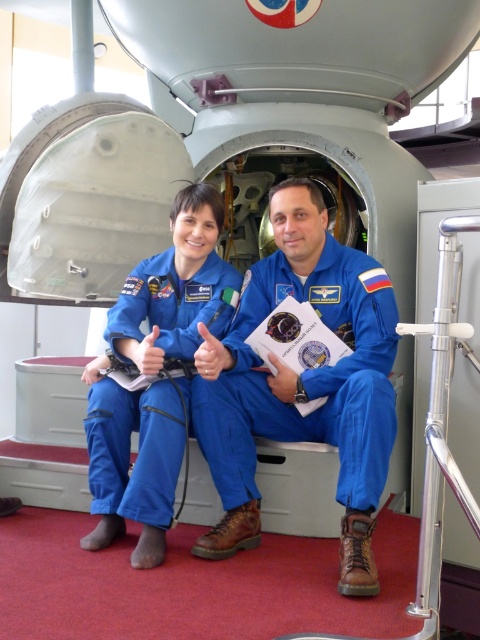
You are an astronaut inside the space capsule. You need to reach the control panel to adjust the settings. The control panel is located at point (301, 384). Can you tell me which object is at that point?

The blue fabric spacesuit at center is located at point (301, 384).

You are an engineer inspecting the space capsule. You notice two astronauts in blue suits. Which astronaut is sitting to the right of the other? The astronauts are wearing the blue fabric spacesuit at center and the matte blue jumpsuit at center.

The blue fabric spacesuit at center is positioned on the right side of matte blue jumpsuit at center, so the astronaut in the blue fabric spacesuit at center is sitting to the right of the one in the matte blue jumpsuit at center.

You are an engineer designing a new space capsule interior. You need to ensure there is enough space between the two astronauts seated in the blue fabric spacesuit at center and the matte blue jumpsuit at center. Based on the image provided, which astronaut requires more space to accommodate their suit?

The blue fabric spacesuit at center requires more space because its width is larger than the matte blue jumpsuit at center.